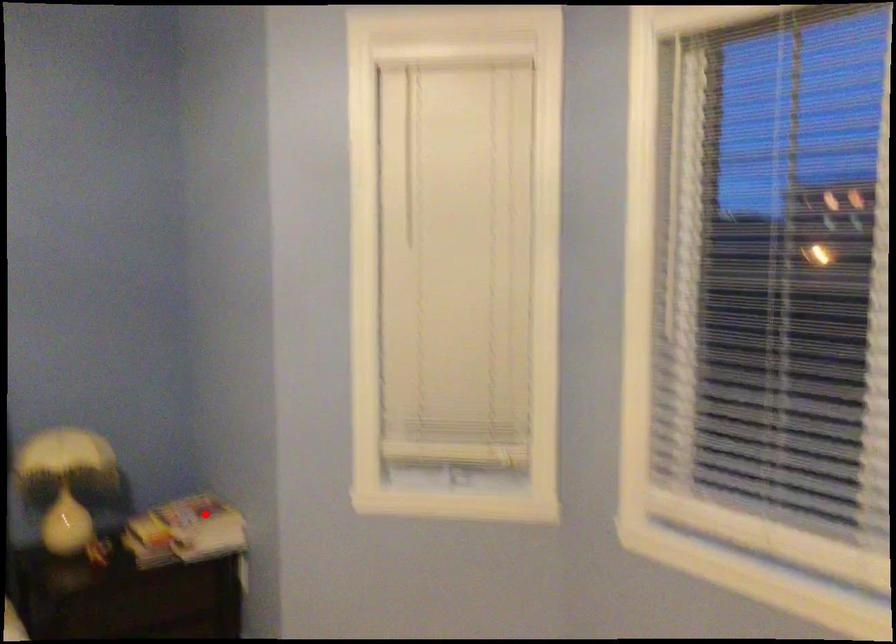
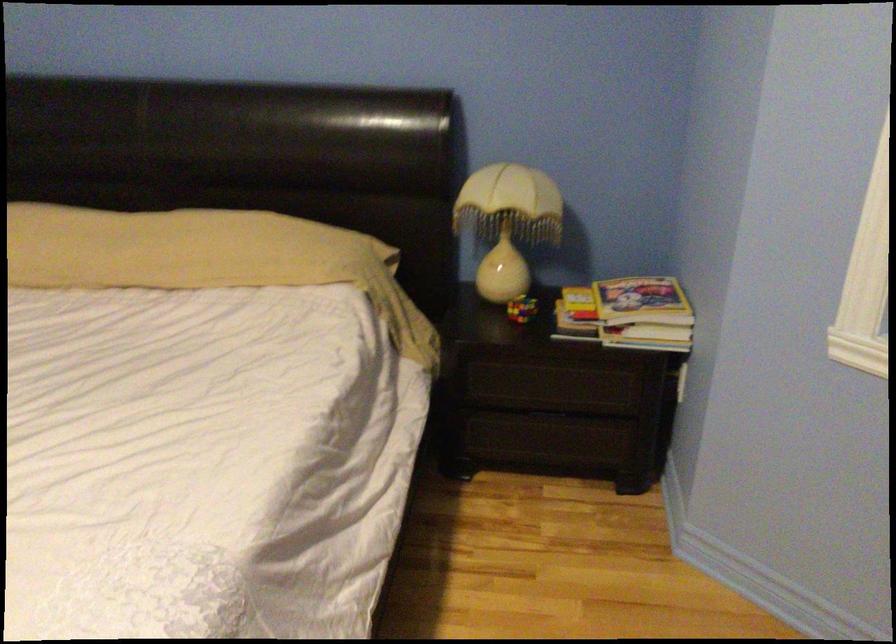
Question: I am providing you with two images of the same scene from different viewpoints. In image1, a red point is highlighted. Considering the same 3D point in image2, which of the following is correct?

Choices:
 (A) It is closer
 (B) It is farther

Answer: (A)